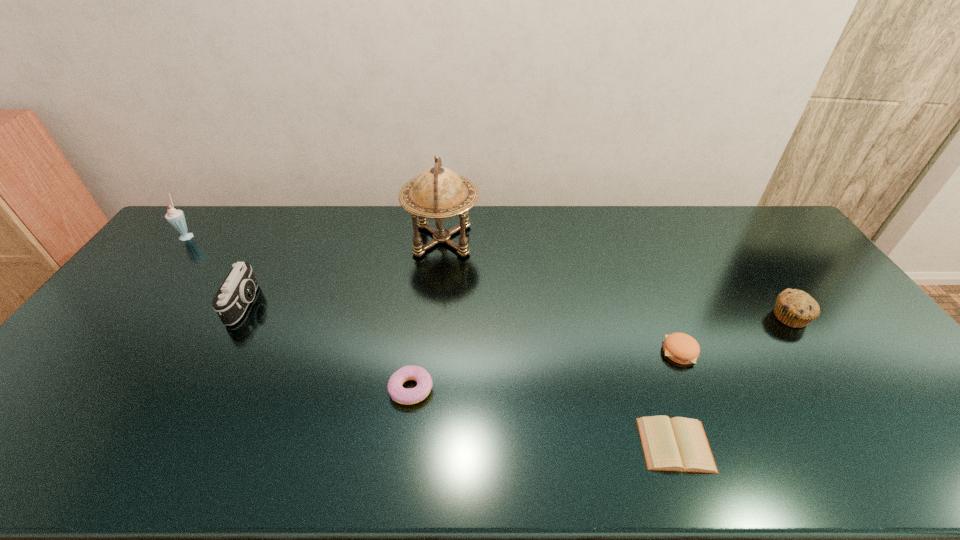
Locate an element on the screen. the tallest object is located at coordinates (438, 193).

Identify the location of the leftmost object. The image size is (960, 540). (176, 218).

Identify the location of milkshake. The image size is (960, 540). (176, 218).

Find the location of `the second object from left to right`. the second object from left to right is located at coordinates (238, 290).

Where is `the fifth shortest object`? The height and width of the screenshot is (540, 960). the fifth shortest object is located at coordinates (238, 290).

Where is `the fourth tallest object`? This screenshot has width=960, height=540. the fourth tallest object is located at coordinates (795, 308).

Identify the location of muffin. The height and width of the screenshot is (540, 960). (795, 308).

At what (x,y) coordinates should I click in order to perform the action: click on the third nearest object. Please return your answer as a coordinate pair (x, y). The image size is (960, 540). Looking at the image, I should click on (681, 348).

At what (x,y) coordinates should I click in order to perform the action: click on the sixth farthest object. Please return your answer as a coordinate pair (x, y). Looking at the image, I should click on (399, 394).

Where is `the nearest object`? This screenshot has height=540, width=960. the nearest object is located at coordinates (680, 444).